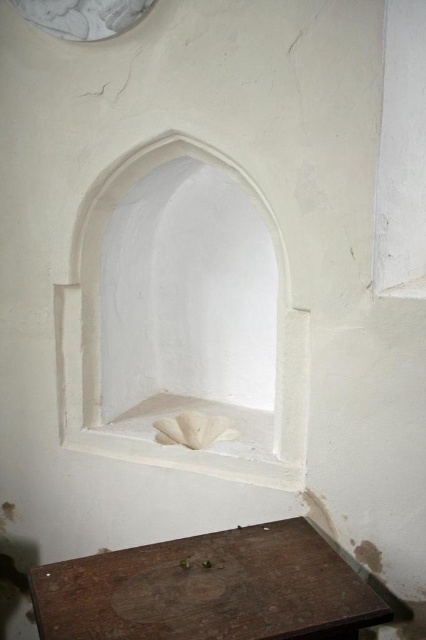
Question: Which point is farther from the camera taking this photo?

Choices:
 (A) (94, 604)
 (B) (91, 307)

Answer: (B)

Question: In this image, where is wooden table at lower right located relative to white smooth stone niche at center?

Choices:
 (A) left
 (B) right

Answer: (B)

Question: Can you confirm if wooden table at lower right is positioned above white smooth stone niche at center?

Choices:
 (A) no
 (B) yes

Answer: (A)

Question: Does wooden table at lower right lie behind white smooth stone niche at center?

Choices:
 (A) yes
 (B) no

Answer: (B)

Question: Which point is closer to the camera?

Choices:
 (A) wooden table at lower right
 (B) white smooth stone niche at center

Answer: (A)